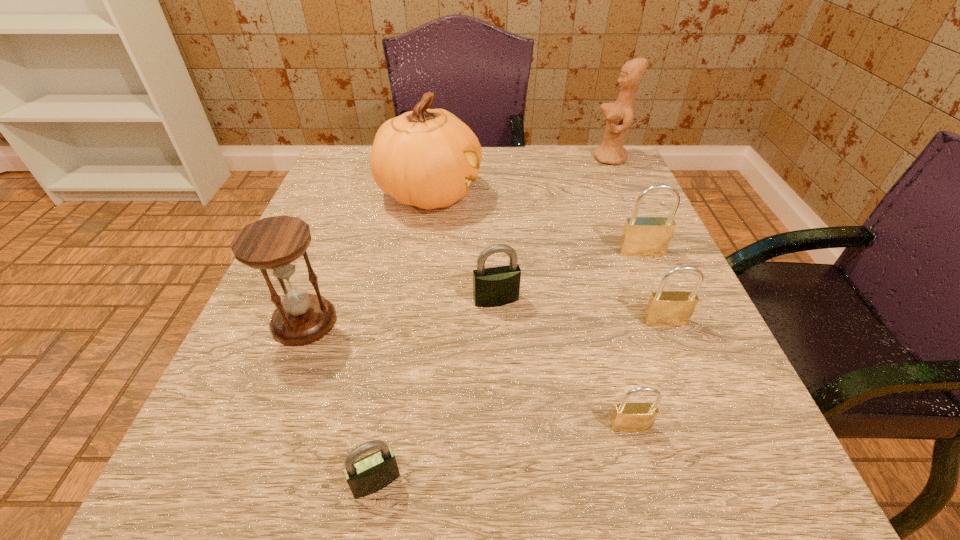
Where is `the closest brass padlock to the figurine`? This screenshot has width=960, height=540. the closest brass padlock to the figurine is located at coordinates (642, 236).

Point out which brass padlock is positioned as the nearest to the second biggest brass padlock. Please provide its 2D coordinates. Your answer should be formatted as a tuple, i.e. [(x, y)], where the tuple contains the x and y coordinates of a point satisfying the conditions above.

[(642, 236)]

In order to click on vacant position in the image that satisfies the following two spatial constraints: 1. on the front-facing side of the figurine; 2. on the front side of the nearest object in this screenshot , I will do `click(754, 482)`.

This screenshot has height=540, width=960. Find the location of `free space that satisfies the following two spatial constraints: 1. on the front face of the pumpkin; 2. on the back side of the fourth nearest padlock`. free space that satisfies the following two spatial constraints: 1. on the front face of the pumpkin; 2. on the back side of the fourth nearest padlock is located at coordinates point(413,300).